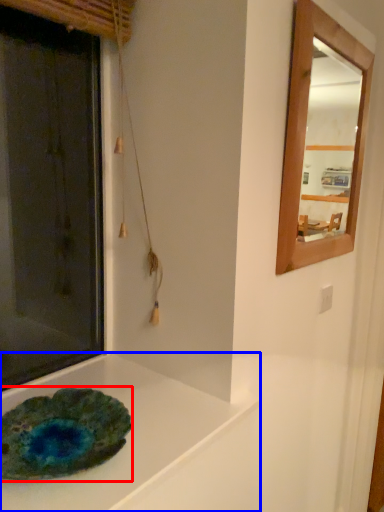
Question: Which point is further to the camera, glass plate (highlighted by a red box) or counter top (highlighted by a blue box)?

Choices:
 (A) glass plate
 (B) counter top

Answer: (A)